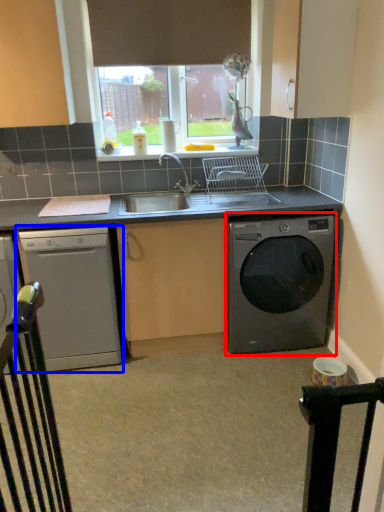
Question: Which point is closer to the camera, washing machine (highlighted by a red box) or dishwasher (highlighted by a blue box)?

Choices:
 (A) washing machine
 (B) dishwasher

Answer: (B)